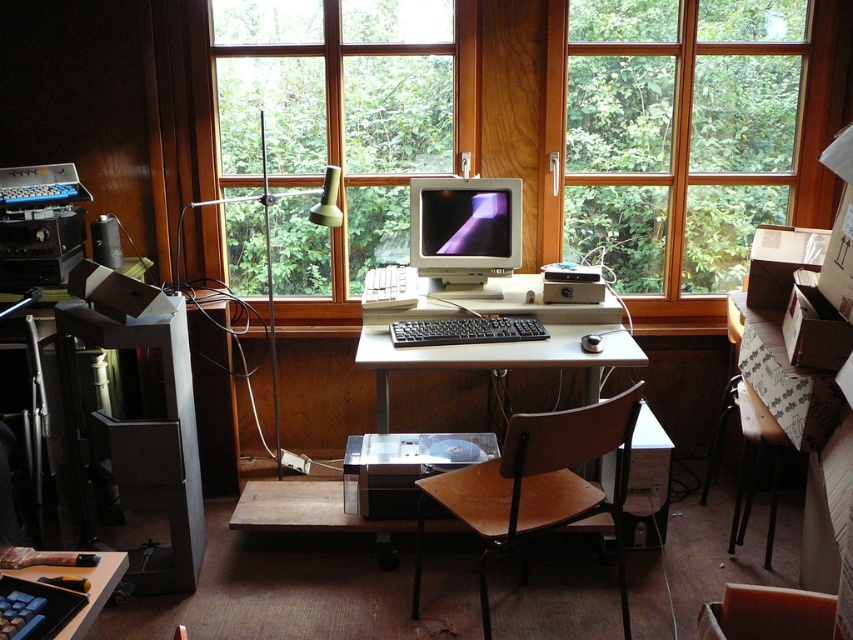
Question: Which point is farther from the camera taking this photo?

Choices:
 (A) (84, 576)
 (B) (621, 22)
 (C) (451, 289)

Answer: (B)

Question: Does transparent glass window at center appear on the left side of matte gray monitor at center?

Choices:
 (A) yes
 (B) no

Answer: (B)

Question: Which point appears farthest from the camera in this image?

Choices:
 (A) (670, 28)
 (B) (505, 497)

Answer: (A)

Question: Is black plastic printer at center to the right of matte silver monitor at center from the viewer's perspective?

Choices:
 (A) no
 (B) yes

Answer: (A)

Question: Is transparent glass window at center to the right of brown wood swivel chair at center from the viewer's perspective?

Choices:
 (A) no
 (B) yes

Answer: (B)

Question: Which point is farther from the camera taking this photo?

Choices:
 (A) (434, 16)
 (B) (772, 33)
 (C) (421, 436)
 (D) (428, 483)

Answer: (B)